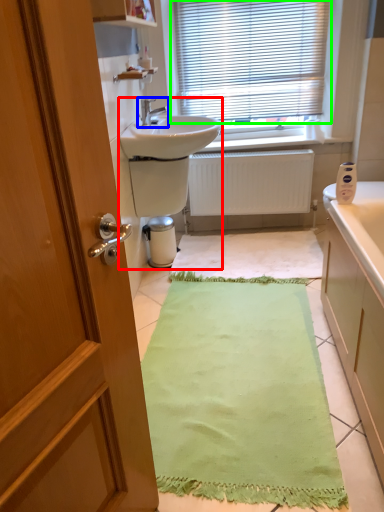
Question: Based on their relative distances, which object is farther from sink (highlighted by a red box)? Choose from tap (highlighted by a blue box) and window blind (highlighted by a green box).

Choices:
 (A) tap
 (B) window blind

Answer: (B)